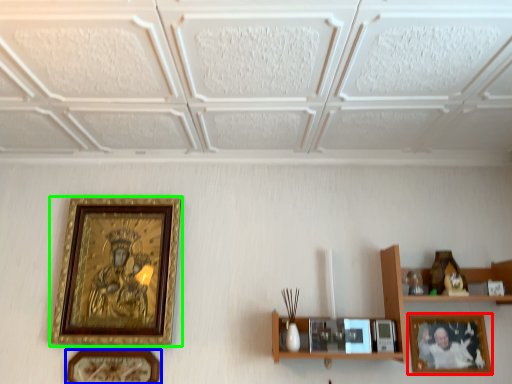
Question: Which object is positioned farthest from picture frame (highlighted by a red box)? Select from picture frame (highlighted by a blue box) and picture frame (highlighted by a green box).

Choices:
 (A) picture frame
 (B) picture frame

Answer: (B)